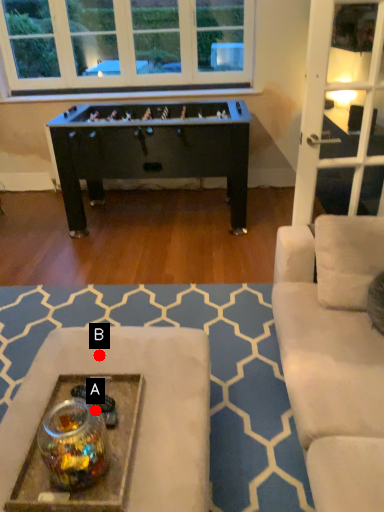
Question: Two points are circled on the image, labeled by A and B beside each circle. Among these points, which one is farthest from the camera?

Choices:
 (A) A is further
 (B) B is further

Answer: (B)